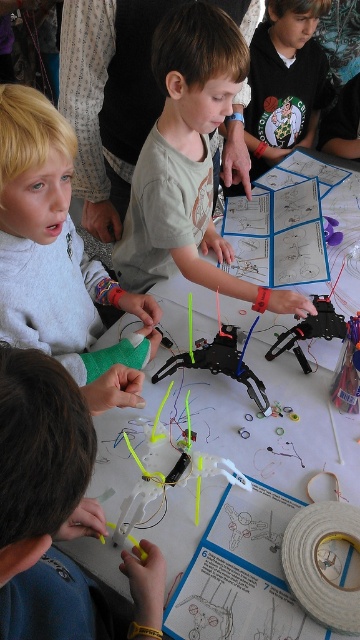
Question: Which object is positioned closest to the black plastic robot at center?

Choices:
 (A) light gray sweater at upper left
 (B) neon yellow plastic propeller at center
 (C) yellow plastic toy at center

Answer: (B)

Question: Which is nearer to the light gray sweater at upper left?

Choices:
 (A) white paper at center
 (B) matte green shirt at center

Answer: (B)

Question: Does matte green shirt at center appear over light gray sweater at upper left?

Choices:
 (A) no
 (B) yes

Answer: (B)

Question: Is light gray sweater at upper left closer to the viewer compared to black plastic robot at center?

Choices:
 (A) yes
 (B) no

Answer: (A)

Question: Estimate the real-world distances between objects in this image. Which object is closer to the white paper at center?

Choices:
 (A) yellow plastic toy at center
 (B) matte black robot at center

Answer: (B)

Question: Does yellow plastic toy at center have a larger size compared to matte green shirt at center?

Choices:
 (A) yes
 (B) no

Answer: (B)